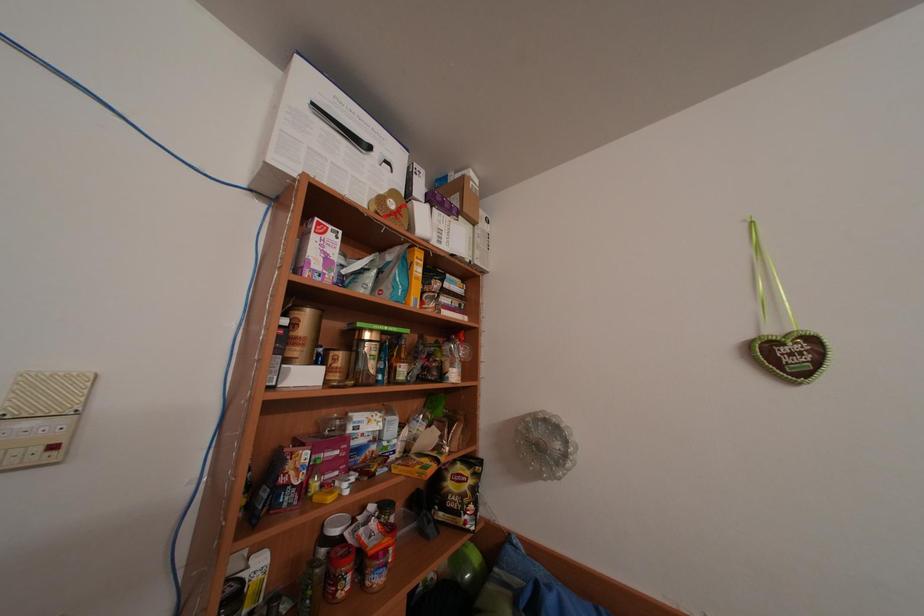
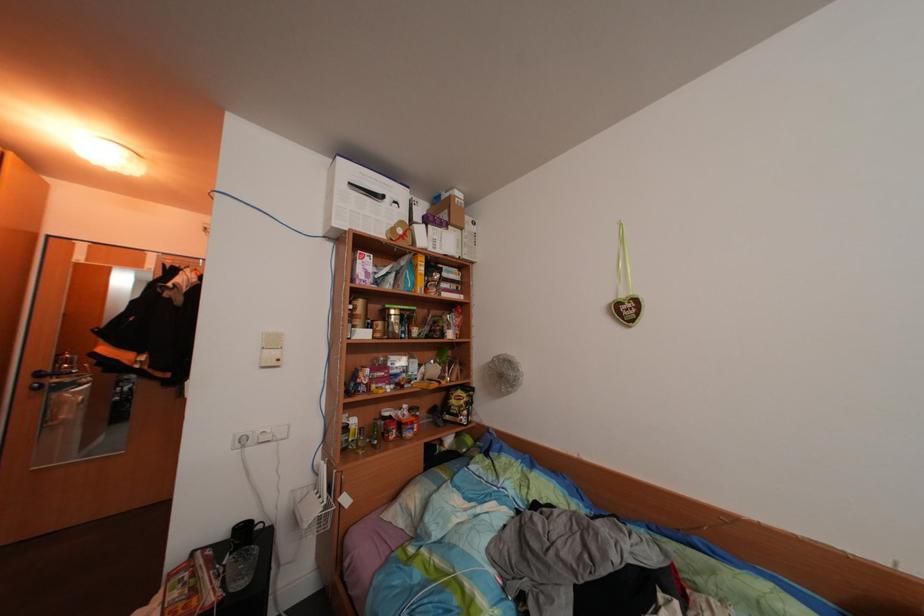
Question: Based on the continuous images, in which direction is the camera rotating? Reply with the corresponding letter.

Choices:
 (A) Left
 (B) Right
 (C) Up
 (D) Down

Answer: (A)